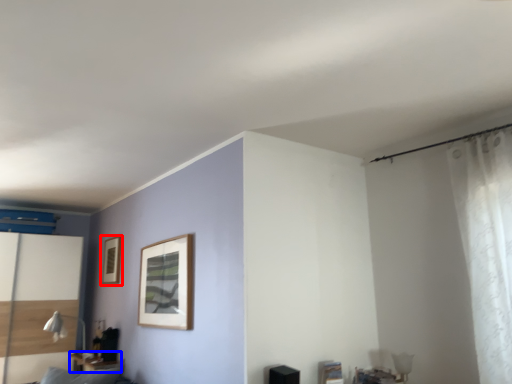
Question: Which of the following is the closest to the observer, picture frame (highlighted by a red box) or table (highlighted by a blue box)?

Choices:
 (A) picture frame
 (B) table

Answer: (B)